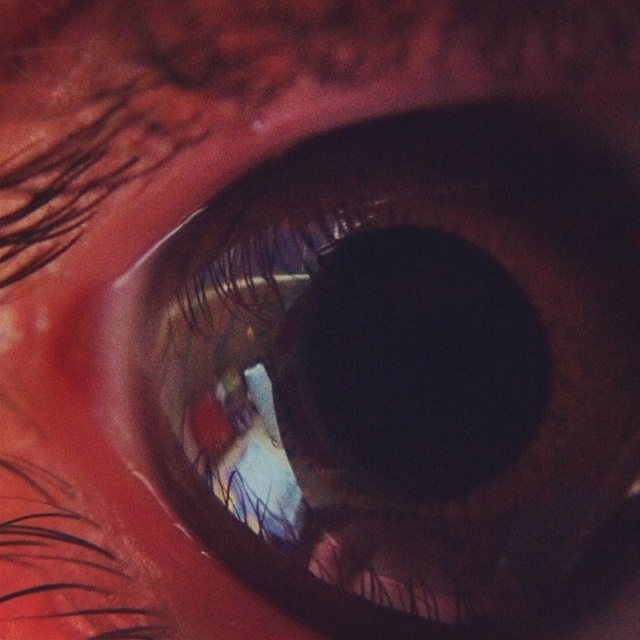
You are a photographer analyzing the reflections in the brown matte eye at center and the black matte lens at center. Which object is located more to the left in the reflection?

The brown matte eye at center is positioned on the left side of black matte lens at center in the reflection.

You are a photographer analyzing the reflection in the eye. You see two points in the reflection at coordinates point (586,397) and point (307,339). Which point is closer to the camera based on their positions in the reflection?

Point (586,397) is in front of point (307,339), so it is closer to the camera.

You are a photographer analyzing the reflection in the brown matte eye at center and the black matte lens at center. Which object is positioned higher in the image?

The black matte lens at center is positioned higher than the brown matte eye at center.